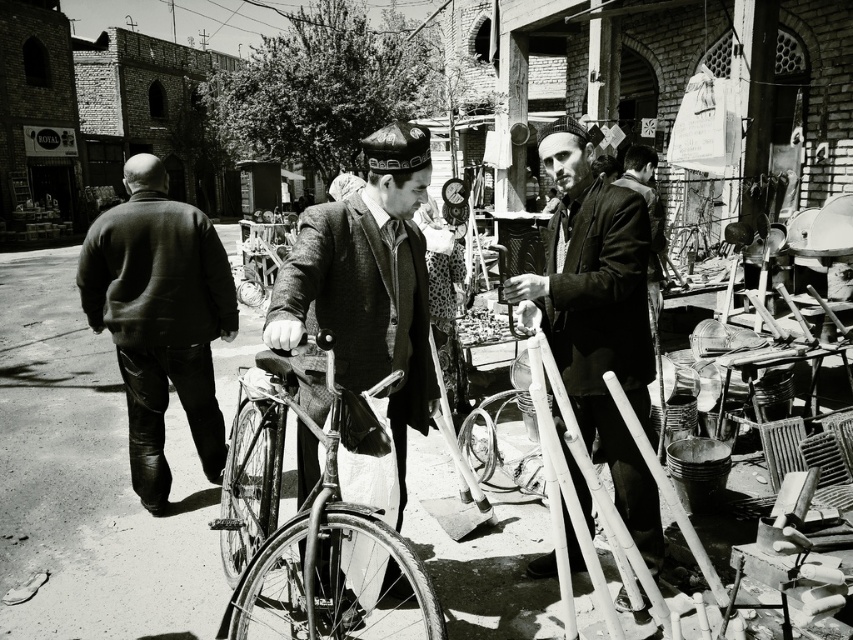
Question: In this image, where is textured woolen coat at center located relative to leather jacket at left?

Choices:
 (A) above
 (B) below

Answer: (B)

Question: Which object is positioned closest to the leather jacket at left?

Choices:
 (A) textured woolen coat at center
 (B) smooth leather jacket at center

Answer: (A)

Question: Can you confirm if shiny metallic bicycle at center is thinner than smooth leather jacket at center?

Choices:
 (A) yes
 (B) no

Answer: (B)

Question: Is textured woolen coat at center wider than shiny metallic bicycle at center?

Choices:
 (A) yes
 (B) no

Answer: (B)

Question: Which of the following is the farthest from the observer?

Choices:
 (A) (647, 244)
 (B) (688, 253)
 (C) (160, 308)

Answer: (B)

Question: Which object is closer to the camera taking this photo?

Choices:
 (A) textured woolen coat at center
 (B) shiny metallic bicycle at center
 (C) leather jacket at left
 (D) smooth leather jacket at center

Answer: (A)